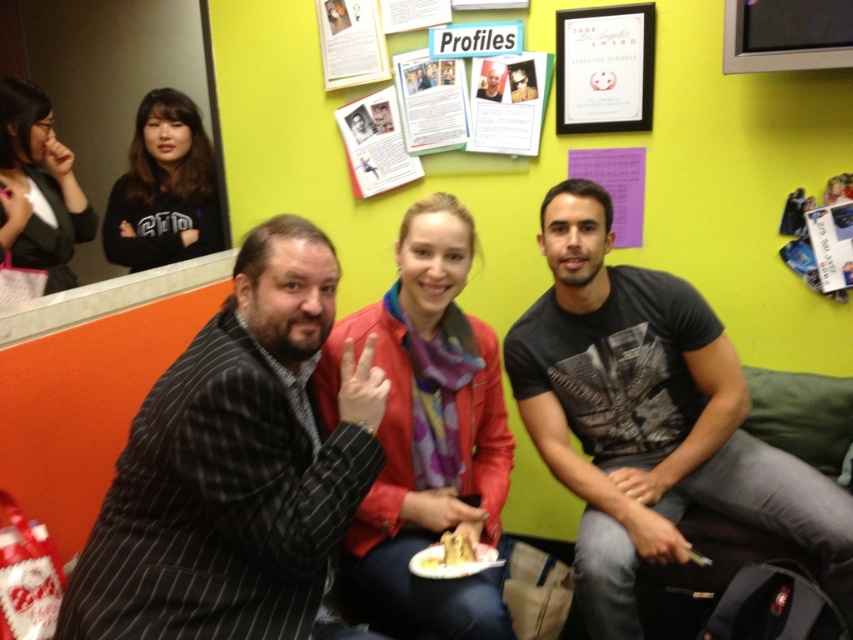
Question: Does black pinstripe suit at center lie behind red leather jacket at center?

Choices:
 (A) no
 (B) yes

Answer: (A)

Question: Can you confirm if black matte shirt at upper left is thinner than yellow crumbly cake at center?

Choices:
 (A) no
 (B) yes

Answer: (A)

Question: Based on their relative distances, which object is farther from the yellow crumbly cake at center?

Choices:
 (A) black pinstripe suit at center
 (B) black matte shirt at upper left
 (C) matte paper poster at upper center

Answer: (B)

Question: Which object appears farthest from the camera in this image?

Choices:
 (A) yellow crumbly cake at center
 (B) white paper plate at center
 (C) black cotton t-shirt at center

Answer: (A)

Question: Considering the relative positions of black pinstripe suit at center and black matte jacket at left in the image provided, where is black pinstripe suit at center located with respect to black matte jacket at left?

Choices:
 (A) above
 (B) below

Answer: (B)

Question: Which point is closer to the camera taking this photo?

Choices:
 (A) (468, 266)
 (B) (572, 282)

Answer: (A)